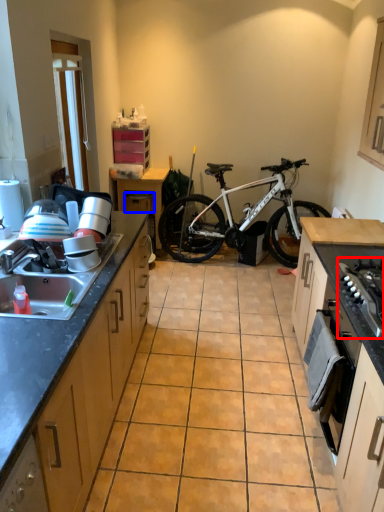
Question: Which object is further to the camera taking this photo, gas stove (highlighted by a red box) or drawer (highlighted by a blue box)?

Choices:
 (A) gas stove
 (B) drawer

Answer: (B)